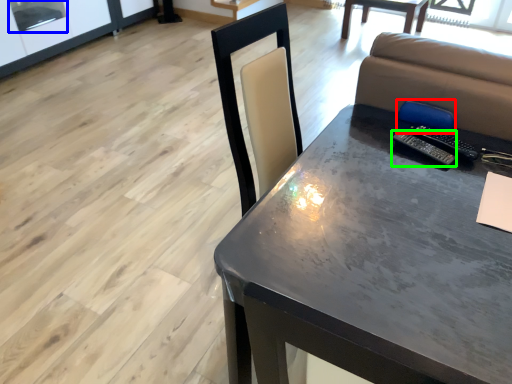
Question: Considering the real-world distances, which object is farthest from armchair (highlighted by a red box)? window screen (highlighted by a blue box) or remote (highlighted by a green box)?

Choices:
 (A) window screen
 (B) remote

Answer: (A)